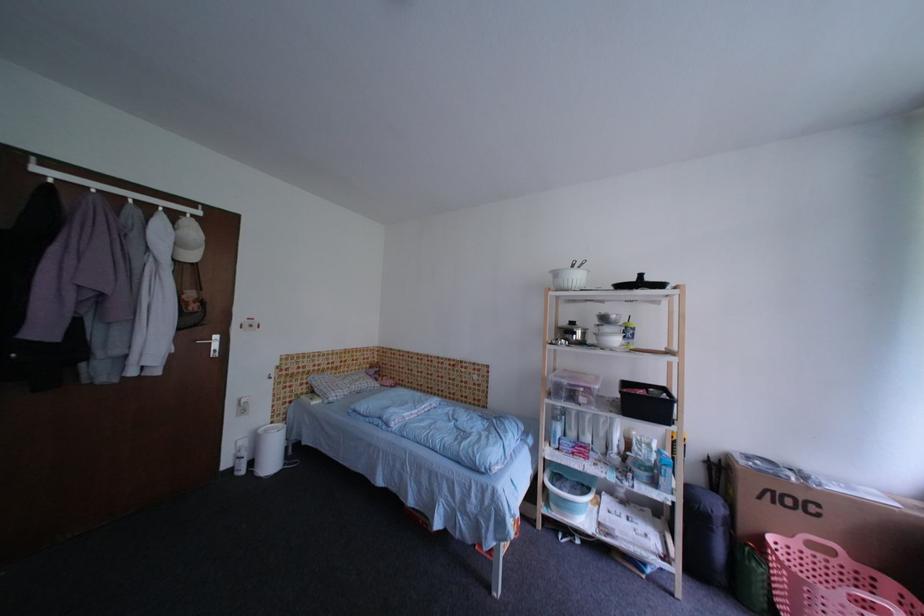
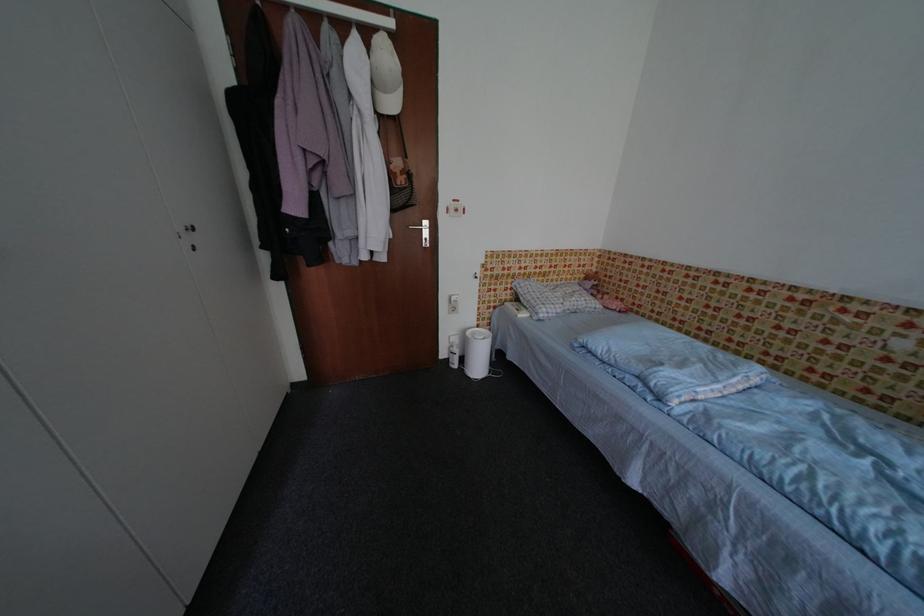
In the second image, find the point that corresponds to (x=310, y=397) in the first image.

(514, 302)